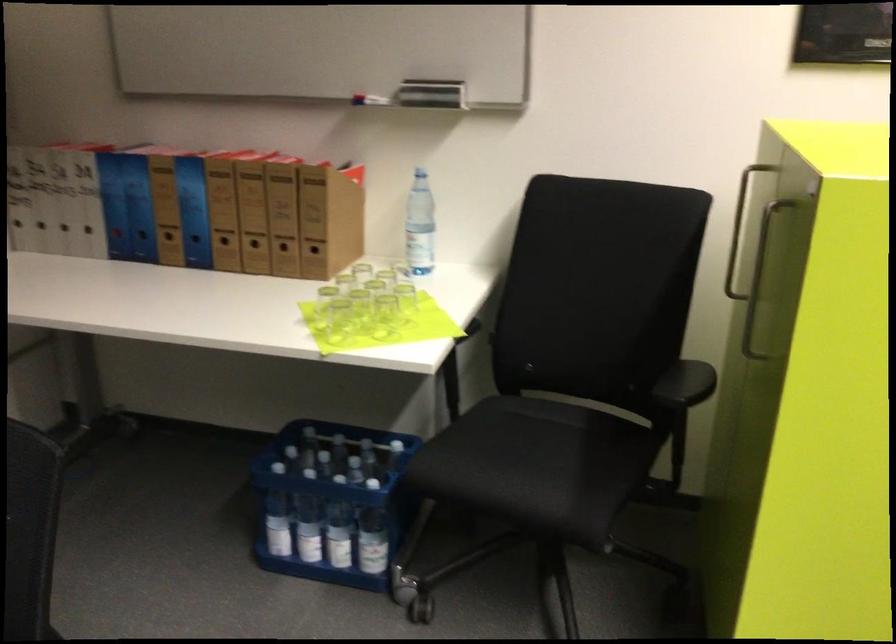
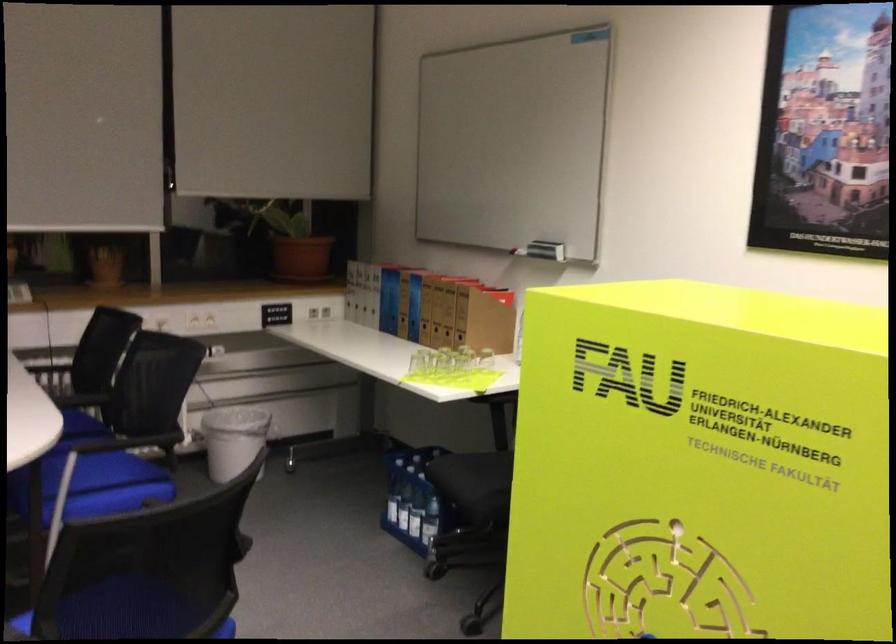
Question: I am providing you with two images of the same scene from different viewpoints. After the viewpoint changes to image2, which objects are now occluded?

Choices:
 (A) metal cabinet handle
 (B) whiteboard eraser holder
 (C) small glass cup
 (D) purple dumbbell

Answer: (A)